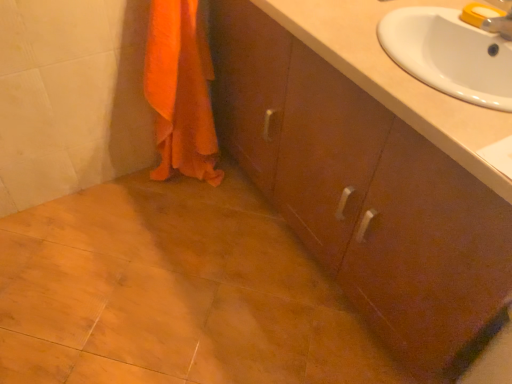
Question: Can you confirm if white glossy sink at upper right is bigger than brown wood cabinet at center?

Choices:
 (A) yes
 (B) no

Answer: (B)

Question: From the image's perspective, is white glossy sink at upper right located beneath brown wood cabinet at center?

Choices:
 (A) yes
 (B) no

Answer: (B)

Question: Is white glossy sink at upper right positioned with its back to brown wood cabinet at center?

Choices:
 (A) yes
 (B) no

Answer: (A)

Question: From the image's perspective, is white glossy sink at upper right located above brown wood cabinet at center?

Choices:
 (A) yes
 (B) no

Answer: (A)

Question: Is white glossy sink at upper right oriented towards brown wood cabinet at center?

Choices:
 (A) yes
 (B) no

Answer: (A)

Question: Considering the positions of point (154, 16) and point (401, 3), is point (154, 16) closer or farther from the camera than point (401, 3)?

Choices:
 (A) closer
 (B) farther

Answer: (B)

Question: Relative to white glossy sink at upper right, is orange fabric towel at lower left in front or behind?

Choices:
 (A) behind
 (B) front

Answer: (A)

Question: From a real-world perspective, is orange fabric towel at lower left above or below white glossy sink at upper right?

Choices:
 (A) above
 (B) below

Answer: (B)

Question: Is orange fabric towel at lower left taller or shorter than white glossy sink at upper right?

Choices:
 (A) short
 (B) tall

Answer: (B)

Question: In terms of width, does orange fabric towel at lower left look wider or thinner when compared to brown wood cabinet at center?

Choices:
 (A) thin
 (B) wide

Answer: (A)

Question: Is point (172, 162) closer or farther from the camera than point (496, 210)?

Choices:
 (A) closer
 (B) farther

Answer: (B)

Question: Relative to brown wood cabinet at center, is orange fabric towel at lower left in front or behind?

Choices:
 (A) front
 (B) behind

Answer: (B)

Question: In the image, is orange fabric towel at lower left on the left side or the right side of brown wood cabinet at center?

Choices:
 (A) right
 (B) left

Answer: (B)

Question: Which is correct: white glossy sink at upper right is inside brown wood cabinet at center, or outside of it?

Choices:
 (A) outside
 (B) inside

Answer: (B)

Question: From a real-world perspective, relative to brown wood cabinet at center, is white glossy sink at upper right vertically above or below?

Choices:
 (A) below
 (B) above

Answer: (B)